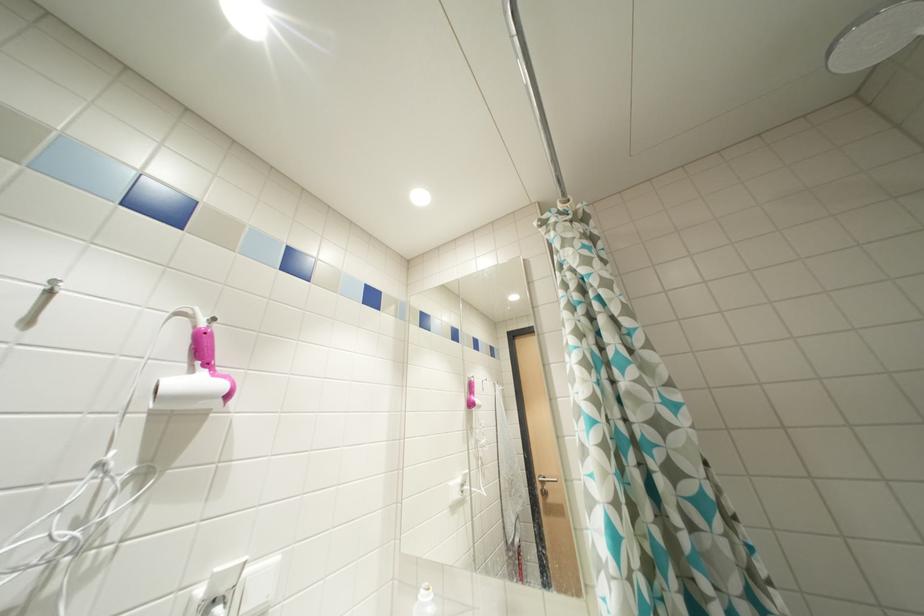
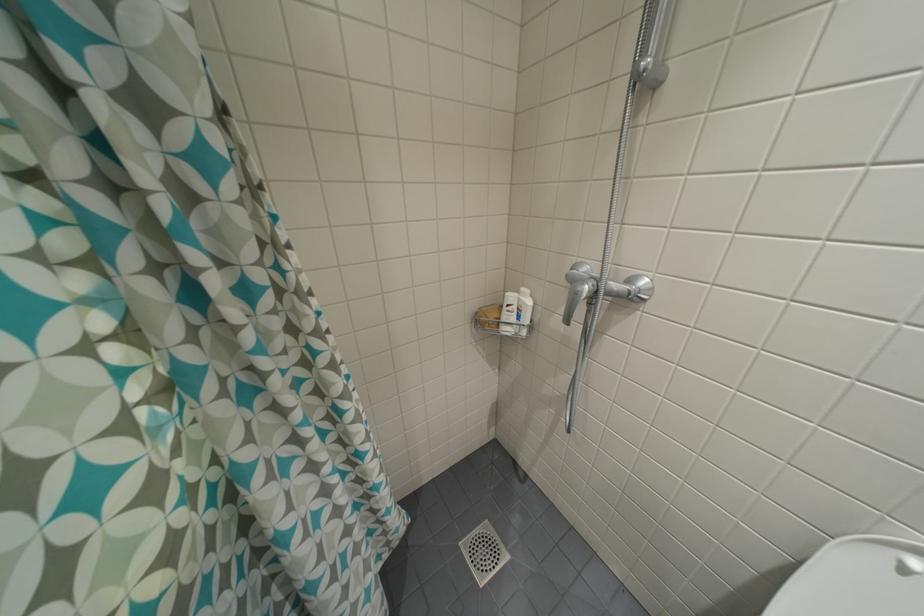
First-person continuous shooting, in which direction is the camera rotating?

The rotation direction of the camera is right-down.